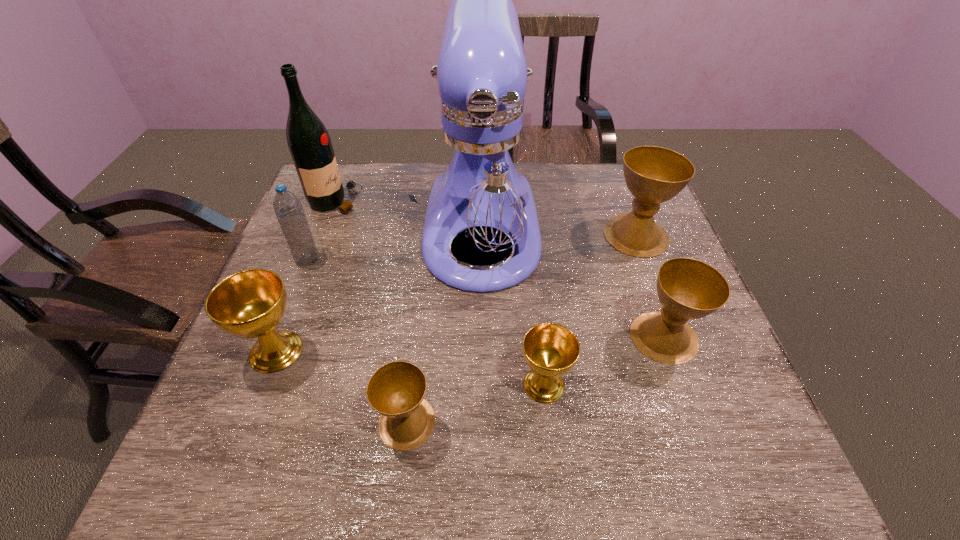
Find the location of a particular element. free space in the image that satisfies the following two spatial constraints: 1. on the front side of the leftmost chalice; 2. on the right side of the blue water bottle is located at coordinates (272, 351).

Identify the location of vacant space that satisfies the following two spatial constraints: 1. on the back side of the nearest brown chalice; 2. on the right side of the farthest chalice. (430, 235).

The image size is (960, 540). I want to click on free space in the image that satisfies the following two spatial constraints: 1. on the surface of the seventh shortest object; 2. on the left side of the second biggest brown chalice, so click(x=284, y=337).